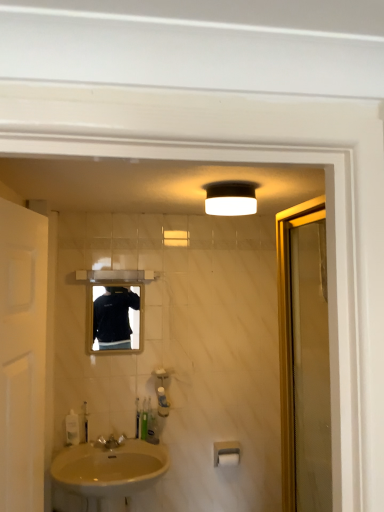
Where is `vacant area situated to the left side of green plastic toothbrush at lower center, which is the fourth toiletry from right to left`? The image size is (384, 512). vacant area situated to the left side of green plastic toothbrush at lower center, which is the fourth toiletry from right to left is located at coordinates (110, 444).